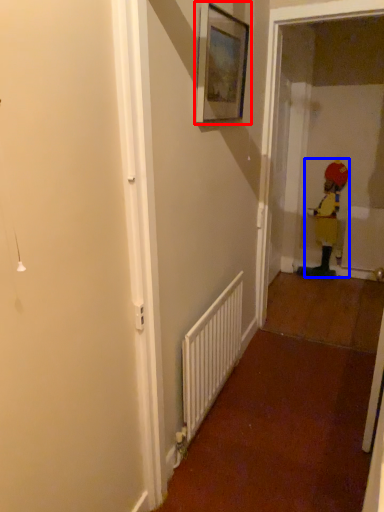
Question: Among these objects, which one is farthest to the camera, picture frame (highlighted by a red box) or toddler (highlighted by a blue box)?

Choices:
 (A) picture frame
 (B) toddler

Answer: (B)